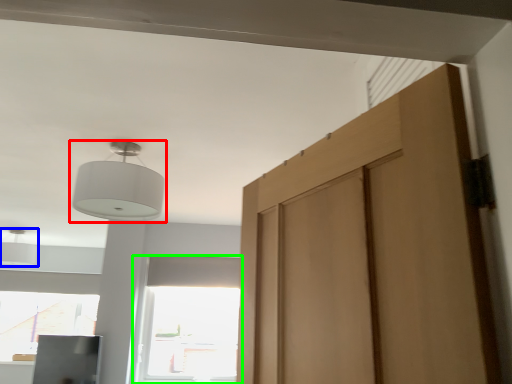
Question: Which object is the closest to the lamp (highlighted by a red box)? Choose among these: light (highlighted by a blue box) or window (highlighted by a green box).

Choices:
 (A) light
 (B) window

Answer: (B)